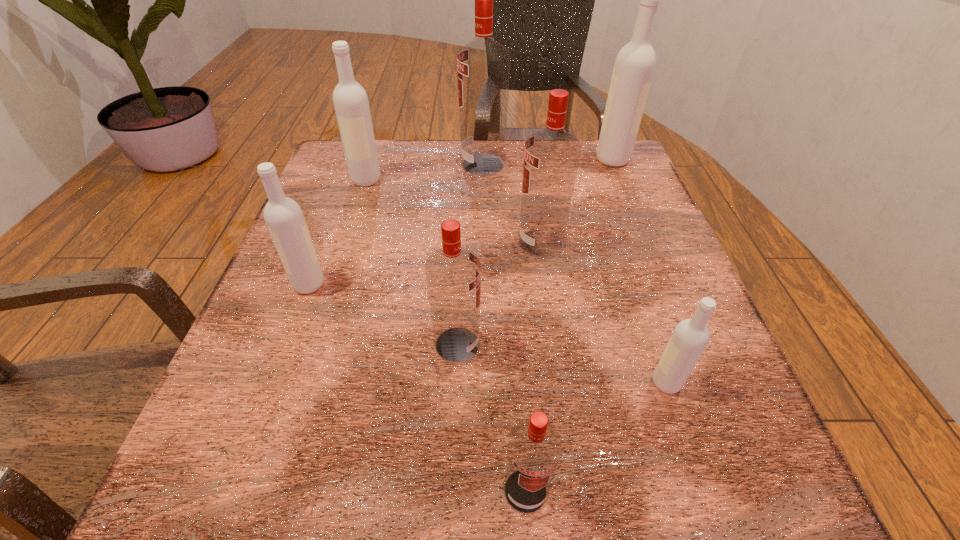
I want to click on free space at the near left corner of the desktop, so click(x=228, y=521).

Identify the location of vacant area between the second nearest red vodka and the second farthest red vodka. This screenshot has height=540, width=960. (499, 294).

The height and width of the screenshot is (540, 960). I want to click on free space that is in between the farthest red vodka and the nearest vodka, so click(x=504, y=328).

You are a GUI agent. You are given a task and a screenshot of the screen. Output one action in this format:
    pyautogui.click(x=<x>, y=<y>)
    Task: Click on the vacant area between the biggest red vodka and the second farthest red vodka
    Image resolution: width=960 pixels, height=540 pixels.
    Given the screenshot: What is the action you would take?
    pyautogui.click(x=512, y=204)

This screenshot has height=540, width=960. Identify the location of free spot between the third smallest red vodka and the farthest red vodka. (512, 204).

Locate an element on the screen. The height and width of the screenshot is (540, 960). free space between the third farthest white vodka and the second nearest vodka is located at coordinates (488, 333).

This screenshot has height=540, width=960. What are the coordinates of `empty location between the smallest white vodka and the fourth nearest object` in the screenshot? It's located at point(488,333).

The width and height of the screenshot is (960, 540). In order to click on vacant area between the biggest red vodka and the nearest red vodka in this screenshot , I will do `click(504, 328)`.

I want to click on vacant space in between the third nearest red vodka and the second nearest object, so click(604, 313).

Identify the location of object that stands as the seventh closest to the biggest white vodka. This screenshot has height=540, width=960. (534, 448).